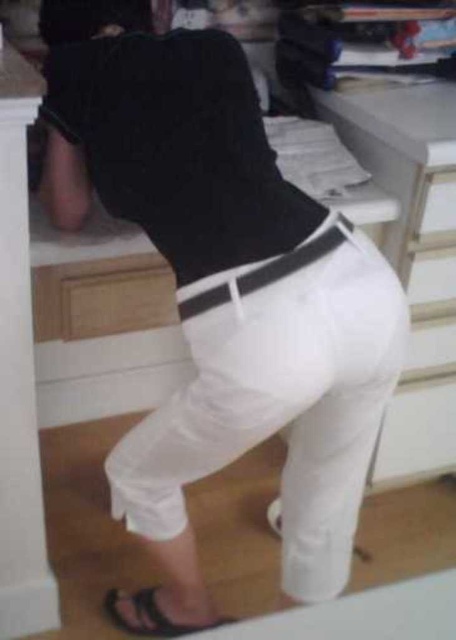
You are a delivery person who needs to place a small package on the surface between the black leather sandal at lower center and the white matte drawer at center. Can you fit the package there?

The black leather sandal at lower center is larger than the white matte drawer at center, so there might not be enough space to fit the small package between them. Check the available space carefully before placing the package.